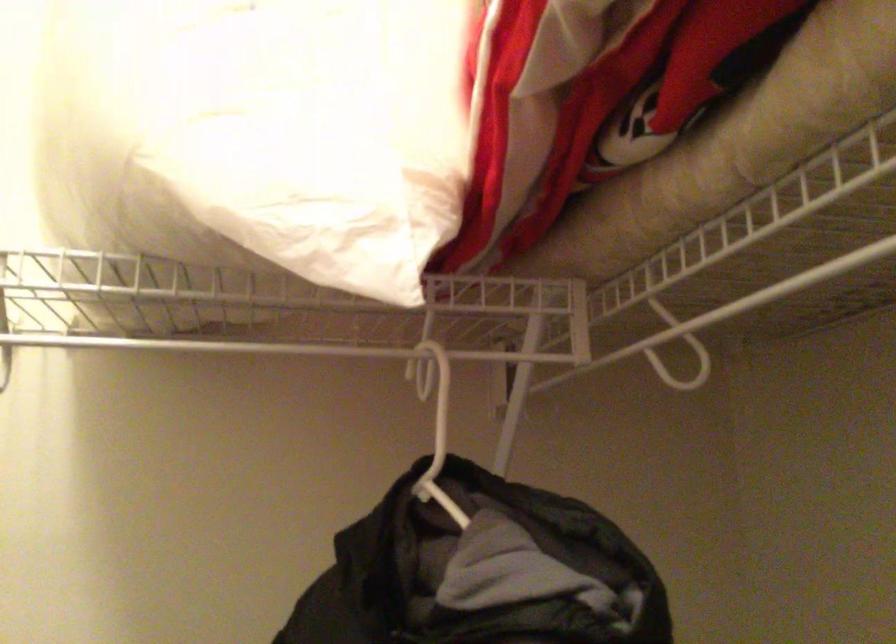
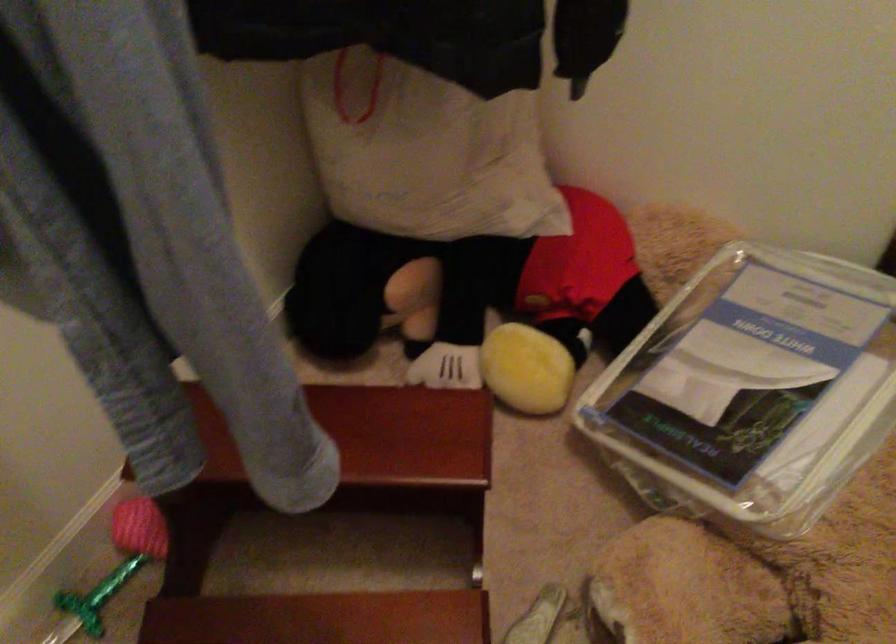
First-person continuous shooting, in which direction is the camera rotating?

The camera's rotation is toward right-down.